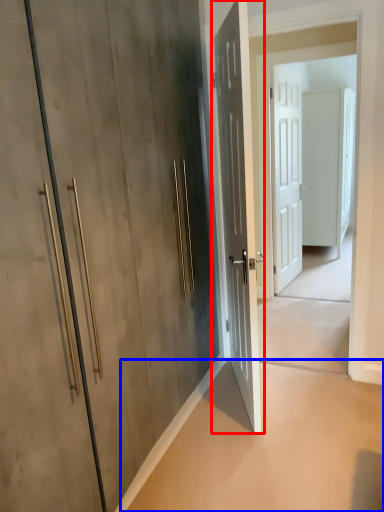
Question: Among these objects, which one is farthest to the camera, door (highlighted by a red box) or concrete (highlighted by a blue box)?

Choices:
 (A) door
 (B) concrete

Answer: (A)